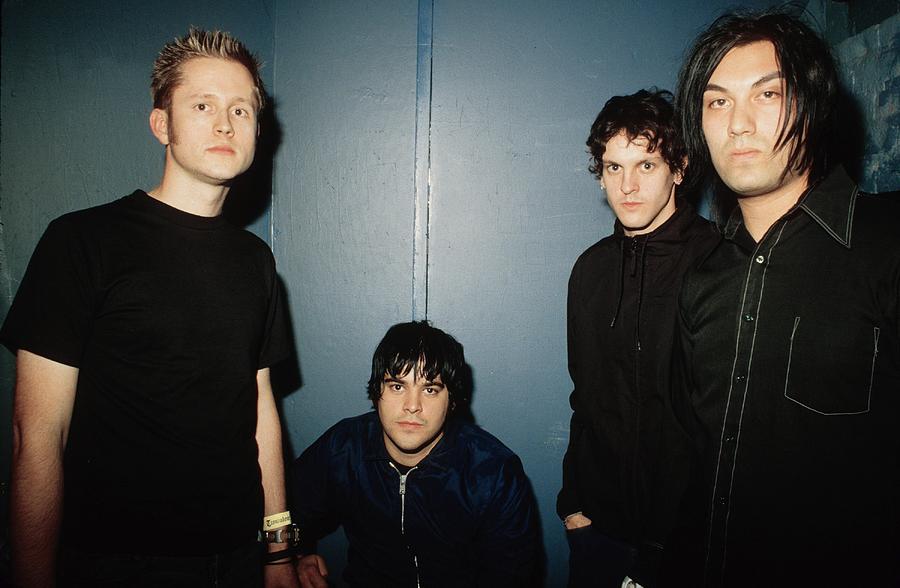
Locate an element on the screen. The image size is (900, 588). blue wall is located at coordinates (465, 205).